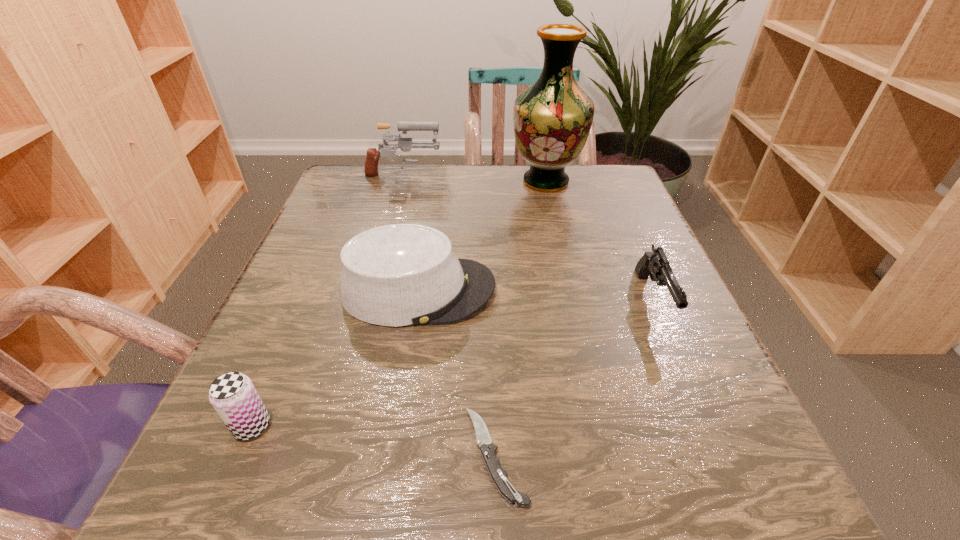
Where is `the fifth object from left to right`? This screenshot has width=960, height=540. the fifth object from left to right is located at coordinates (552, 118).

Where is `the tallest object`? Image resolution: width=960 pixels, height=540 pixels. the tallest object is located at coordinates (552, 118).

You are a GUI agent. You are given a task and a screenshot of the screen. Output one action in this format:
    pyautogui.click(x=<x>, y=<y>)
    Task: Click on the farther gun
    Image resolution: width=960 pixels, height=540 pixels.
    Given the screenshot: What is the action you would take?
    pyautogui.click(x=405, y=144)

This screenshot has width=960, height=540. In order to click on the left gun in this screenshot , I will do `click(405, 144)`.

Locate an element on the screen. hat is located at coordinates (396, 275).

Image resolution: width=960 pixels, height=540 pixels. In order to click on the rightmost object in this screenshot , I will do `click(655, 264)`.

Find the location of a particular element. the right gun is located at coordinates (655, 264).

This screenshot has height=540, width=960. In order to click on beer can in this screenshot , I will do `click(233, 395)`.

Find the location of `pocketknife`. pocketknife is located at coordinates (498, 475).

Find the location of a particular element. This screenshot has height=540, width=960. vacant point located on the front of the second object from right to left is located at coordinates 570,287.